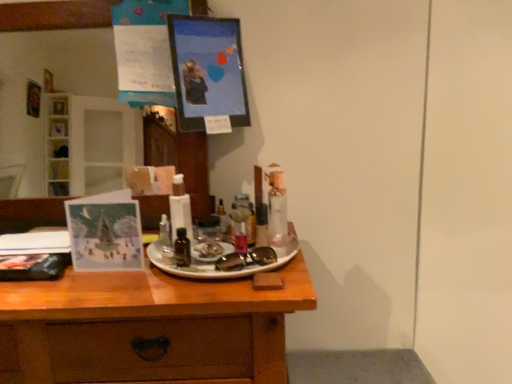
Question: Does black glass bottle at center, which is counted as the first toiletry, starting from the front, contain translucent plastic tube at center, acting as the second toiletry starting from the right?

Choices:
 (A) no
 (B) yes

Answer: (A)

Question: Does black glass bottle at center, the 3th toiletry from the right, have a greater width compared to translucent plastic tube at center, the first toiletry in the back-to-front sequence?

Choices:
 (A) yes
 (B) no

Answer: (B)

Question: Is black glass bottle at center, the first toiletry positioned from the left, taller than translucent plastic tube at center, the third toiletry positioned from the front?

Choices:
 (A) yes
 (B) no

Answer: (B)

Question: Is black glass bottle at center, the 3th toiletry from the right, looking in the opposite direction of translucent plastic tube at center, the 2th toiletry when ordered from left to right?

Choices:
 (A) yes
 (B) no

Answer: (B)

Question: Is the position of black glass bottle at center, the 3th toiletry from the right, more distant than that of translucent plastic tube at center, the third toiletry positioned from the front?

Choices:
 (A) yes
 (B) no

Answer: (B)

Question: In terms of height, does metallic silver spray can at center, which is the 1th toiletry from right to left, look taller or shorter compared to wooden desk at center?

Choices:
 (A) short
 (B) tall

Answer: (A)

Question: Based on their positions, is metallic silver spray can at center, positioned as the 2th toiletry in back-to-front order, located to the left or right of wooden desk at center?

Choices:
 (A) left
 (B) right

Answer: (B)

Question: Considering the positions of metallic silver spray can at center, which is the third toiletry from left to right, and wooden desk at center in the image, is metallic silver spray can at center, which is the third toiletry from left to right, bigger or smaller than wooden desk at center?

Choices:
 (A) big
 (B) small

Answer: (B)

Question: From a real-world perspective, is metallic silver spray can at center, which is the 1th toiletry from right to left, above or below wooden desk at center?

Choices:
 (A) below
 (B) above

Answer: (B)

Question: Choose the correct answer: Is metallic picture frame at upper center inside translucent plastic tube at center, acting as the second toiletry starting from the right, or outside it?

Choices:
 (A) outside
 (B) inside

Answer: (A)

Question: From their relative heights in the image, would you say metallic picture frame at upper center is taller or shorter than translucent plastic tube at center, the third toiletry positioned from the front?

Choices:
 (A) tall
 (B) short

Answer: (A)

Question: Is metallic picture frame at upper center wider or thinner than translucent plastic tube at center, acting as the second toiletry starting from the right?

Choices:
 (A) wide
 (B) thin

Answer: (A)

Question: Looking at the image, does metallic picture frame at upper center seem bigger or smaller compared to translucent plastic tube at center, acting as the second toiletry starting from the right?

Choices:
 (A) small
 (B) big

Answer: (B)

Question: In the image, is wooden desk at center positioned in front of or behind metallic picture frame at upper center?

Choices:
 (A) behind
 (B) front

Answer: (B)

Question: Considering the positions of point (211, 312) and point (180, 94), is point (211, 312) closer or farther from the camera than point (180, 94)?

Choices:
 (A) farther
 (B) closer

Answer: (B)